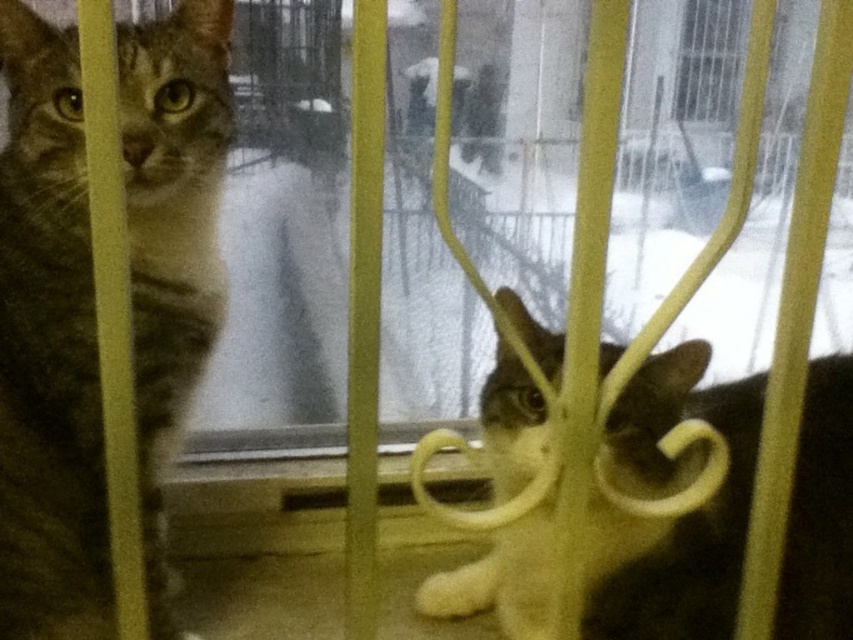
Does tabby fur cat at left have a smaller size compared to dark brown fur cat at center?

Yes.

Is tabby fur cat at left above dark brown fur cat at center?

Correct, tabby fur cat at left is located above dark brown fur cat at center.

Locate an element on the screen. tabby fur cat at left is located at coordinates (48, 349).